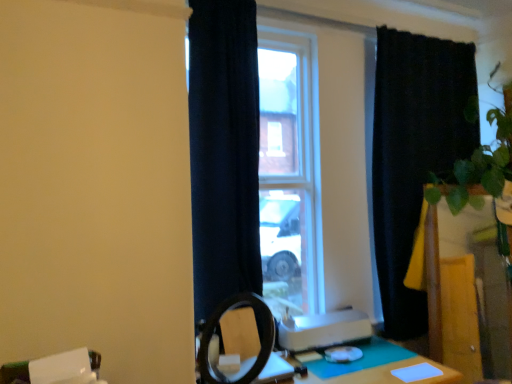
Question: From the image's perspective, is green matte plant at right above or below green felt table at lower right?

Choices:
 (A) below
 (B) above

Answer: (B)

Question: Would you say green matte plant at right is inside or outside green felt table at lower right?

Choices:
 (A) inside
 (B) outside

Answer: (B)

Question: Estimate the real-world distances between objects in this image. Which object is closer to the green felt table at lower right?

Choices:
 (A) navy blue curtain at center, which is the 1th curtain in front-to-back order
 (B) black velvet curtain at right, which ranks as the first curtain in back-to-front order
 (C) green matte plant at right

Answer: (C)

Question: Considering the real-world distances, which object is farthest from the navy blue curtain at center, the first curtain when ordered from left to right?

Choices:
 (A) green felt table at lower right
 (B) black velvet curtain at right, positioned as the 2th curtain in front-to-back order
 (C) green matte plant at right

Answer: (C)